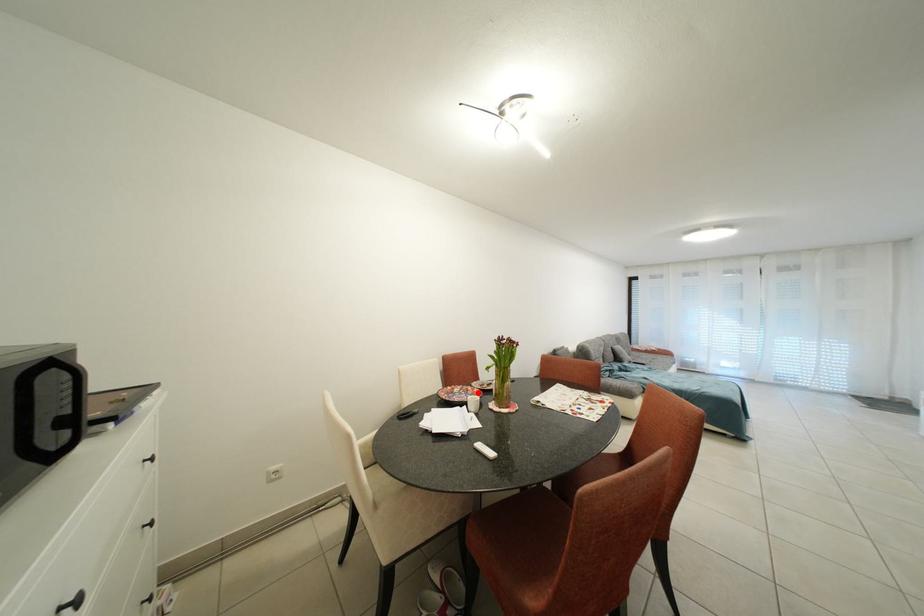
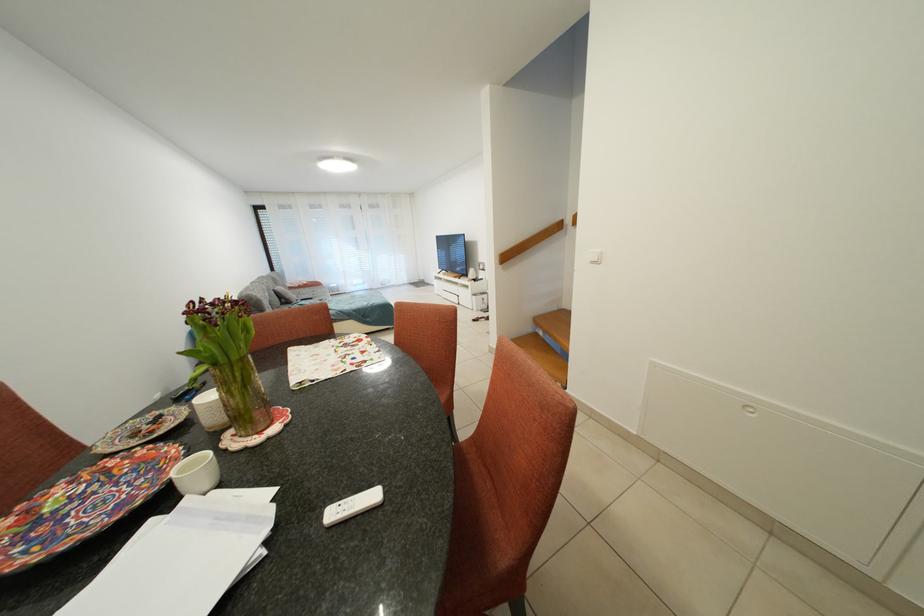
Where in the second image is the point corresponding to the highlighted location from the first image?

(120, 467)